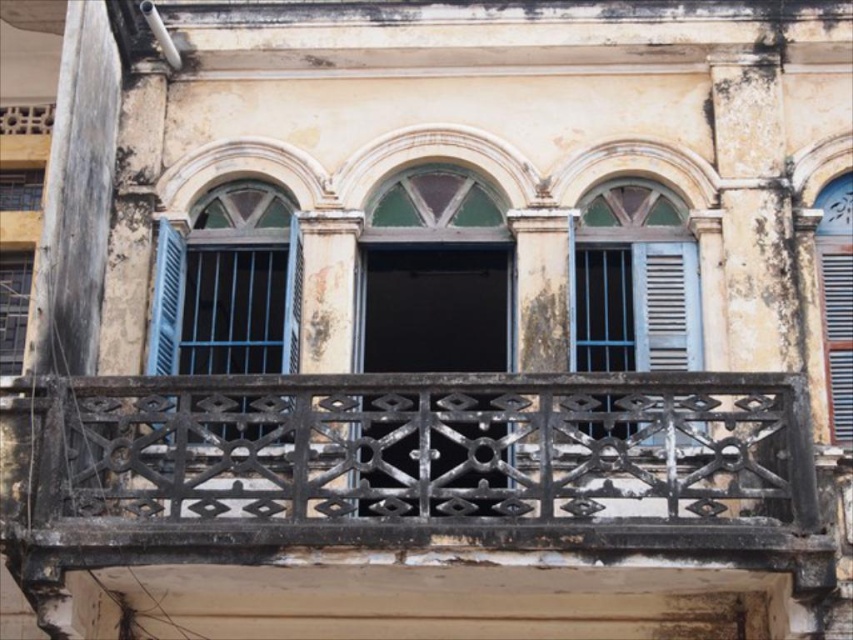
How much distance is there between black wrought iron at center and brown wooden window at right?

black wrought iron at center is 4.96 meters away from brown wooden window at right.

Can you confirm if black wrought iron at center is bigger than brown wooden window at right?

No, black wrought iron at center is not bigger than brown wooden window at right.

Is point (527, 515) behind point (834, 438)?

No, (527, 515) is closer to viewer.

Locate an element on the screen. This screenshot has height=640, width=853. black wrought iron at center is located at coordinates (425, 460).

Is green glass window at center thinner than brown wooden window at right?

No, green glass window at center is not thinner than brown wooden window at right.

Which is in front, point (361, 460) or point (846, 234)?

Point (361, 460) is in front.

Which is behind, point (398, 280) or point (824, 333)?

Point (398, 280)

I want to click on green glass window at center, so click(x=434, y=276).

Is black wrought iron at center smaller than blue wooden window at center?

Indeed, black wrought iron at center has a smaller size compared to blue wooden window at center.

Can you confirm if black wrought iron at center is bigger than blue wooden window at center?

Incorrect, black wrought iron at center is not larger than blue wooden window at center.

Does point (397, 540) come in front of point (573, 324)?

Yes, it is.

This screenshot has height=640, width=853. Identify the location of black wrought iron at center. (425, 460).